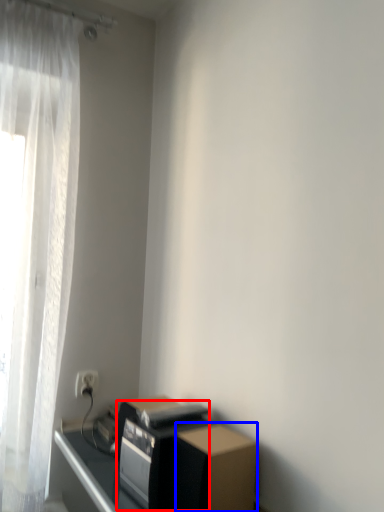
Question: Which object appears closest to the camera in this image, appliance (highlighted by a red box) or cardboard box (highlighted by a blue box)?

Choices:
 (A) appliance
 (B) cardboard box

Answer: (B)